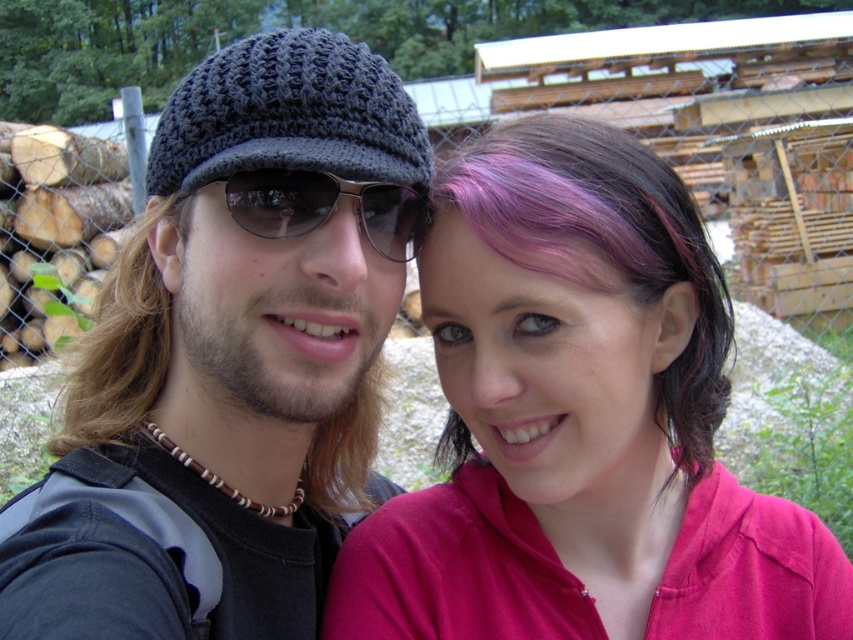
You are a photographer trying to capture a clear photo of the two people in the scene. The brownwoollyhat at left and the sunglasses at center are both visible. Which object is wider in the image?

The brownwoollyhat at left is wider than the sunglasses at center according to the description.

You are a photographer trying to capture the scene where the two people are taking a selfie. The photographer is positioned at the point where the brownwoollyhat at left is located. Where should the photographer move to frame both people equally in the shot?

The photographer should move away from the brownwoollyhat at left to ensure both individuals are equally framed in the shot.